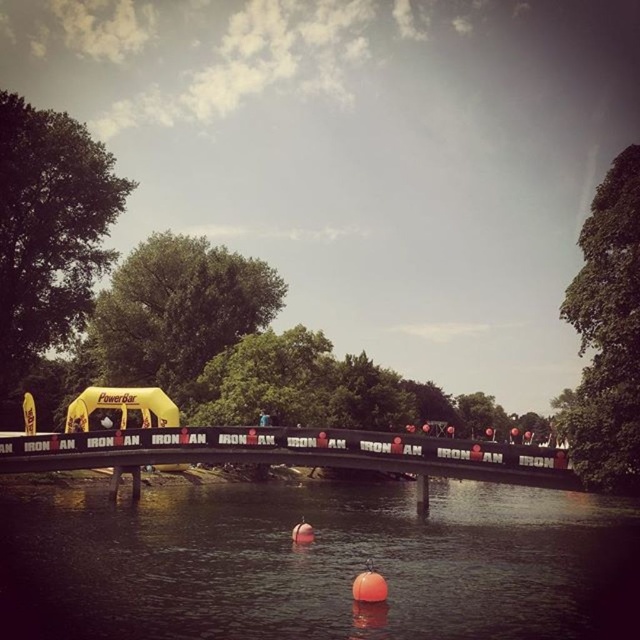
You are a participant in the Ironman triathlon and need to cross the black metal bridge at center. However, there is a black fabric tent at center blocking your path. Can you walk under the tent to cross the bridge?

The black fabric tent at center is positioned over the black metal bridge at center, so yes, you can walk under the tent to cross the bridge since it is above the bridge.

You are a participant in the Ironman event and need to cross the black metal bridge at center. There is a black fabric tent at center blocking your path. Can you walk around it to reach the bridge?

The black fabric tent at center is in front of the black metal bridge at center, so you can walk around the tent to access the bridge.